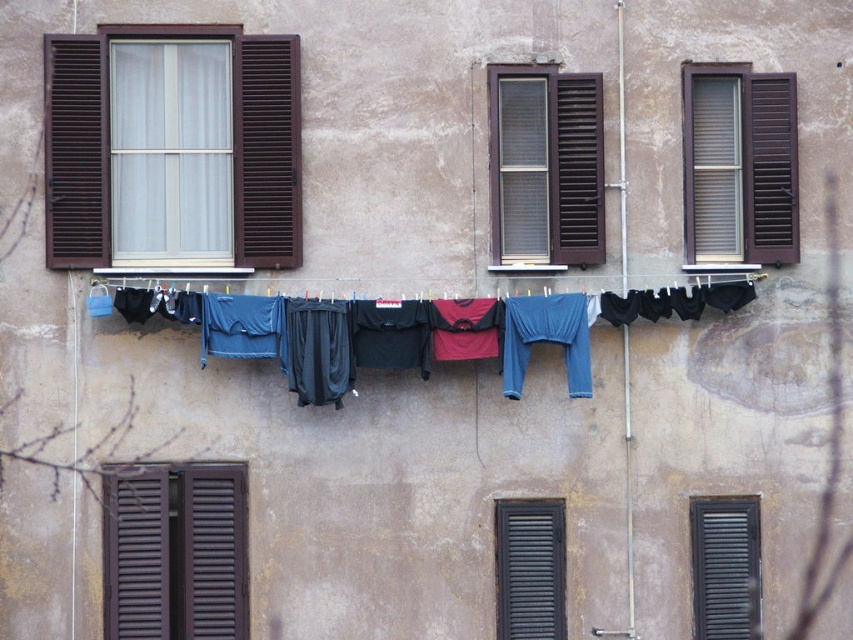
Question: Among these objects, which one is nearest to the camera?

Choices:
 (A) black matte shutter at lower right
 (B) black matte shutter at lower center
 (C) brown wooden window at upper right

Answer: (B)

Question: Is brown wooden window at upper right below brown wooden window at center?

Choices:
 (A) yes
 (B) no

Answer: (B)

Question: Does brown wooden window at center appear on the right side of black matte shutter at lower right?

Choices:
 (A) yes
 (B) no

Answer: (B)

Question: Does brown wooden shutters at lower left have a greater width compared to black matte shutter at lower right?

Choices:
 (A) yes
 (B) no

Answer: (A)

Question: Which point is farther from the camera taking this photo?

Choices:
 (A) click(296, 211)
 (B) click(683, 200)
 (C) click(547, 204)
 (D) click(254, 348)

Answer: (C)

Question: Which object appears closest to the camera in this image?

Choices:
 (A) brown wooden shutter at upper left
 (B) blue fabric clothes at center
 (C) brown wooden window at upper left
 (D) black matte shutter at lower right

Answer: (B)